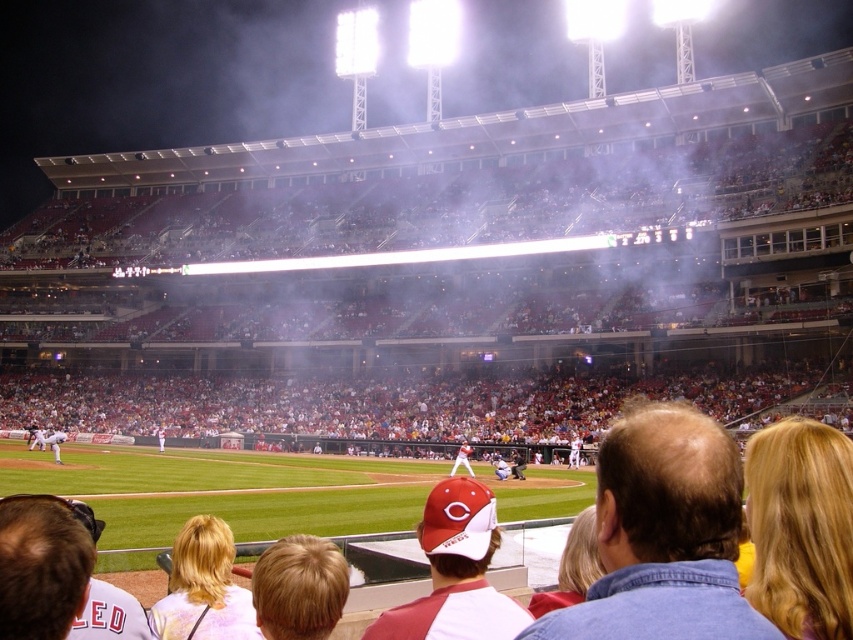
Question: Which of the following is the closest to the observer?

Choices:
 (A) white baseball glove at lower left
 (B) white jersey at center
 (C) matte red cap at center
 (D) white plastic seats at center

Answer: (C)

Question: Among these objects, which one is nearest to the camera?

Choices:
 (A) white jersey at center
 (B) white plastic seats at center

Answer: (A)

Question: Considering the relative positions of white plastic seats at center and blonde hair at lower center in the image provided, where is white plastic seats at center located with respect to blonde hair at lower center?

Choices:
 (A) below
 (B) above

Answer: (B)

Question: Does white plastic seats at center appear on the left side of white jersey at center?

Choices:
 (A) yes
 (B) no

Answer: (A)

Question: Which object appears closest to the camera in this image?

Choices:
 (A) matte red cap at center
 (B) blonde hair at lower center

Answer: (A)

Question: Can you confirm if white plastic seats at center is positioned above white jersey at center?

Choices:
 (A) no
 (B) yes

Answer: (B)